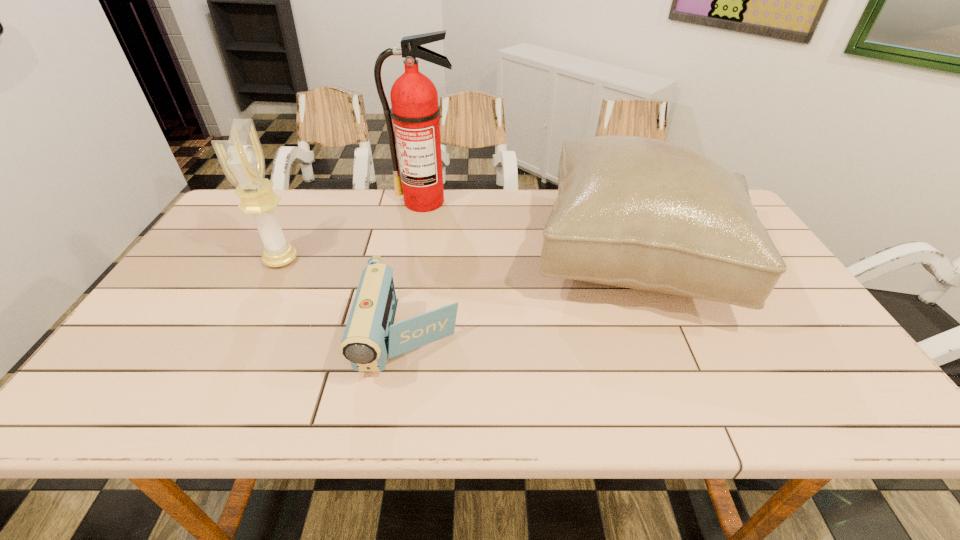
You are a GUI agent. You are given a task and a screenshot of the screen. Output one action in this format:
    pyautogui.click(x=<x>, y=<y>)
    Task: Click on the fire extinguisher
    
    Given the screenshot: What is the action you would take?
    tap(414, 99)

Where is `the second tallest object`? Image resolution: width=960 pixels, height=540 pixels. the second tallest object is located at coordinates (241, 157).

I want to click on the leftmost object, so click(241, 157).

The width and height of the screenshot is (960, 540). What are the coordinates of `cushion` in the screenshot? It's located at (635, 212).

Identify the location of the rightmost object. (635, 212).

Find the location of a particular element. This screenshot has width=960, height=540. the shortest object is located at coordinates (370, 338).

Where is `vacant region located on the side of the tallest object near the handle`? vacant region located on the side of the tallest object near the handle is located at coordinates (409, 293).

The width and height of the screenshot is (960, 540). Find the location of `free space located 0.210m on the front-facing side of the leftmost object`. free space located 0.210m on the front-facing side of the leftmost object is located at coordinates coord(372,260).

The image size is (960, 540). I want to click on free point located on the left of the rightmost object, so click(396, 260).

This screenshot has width=960, height=540. Find the location of `vacant region located on the side of the camcorder with the flip-out screen`. vacant region located on the side of the camcorder with the flip-out screen is located at coordinates (399, 414).